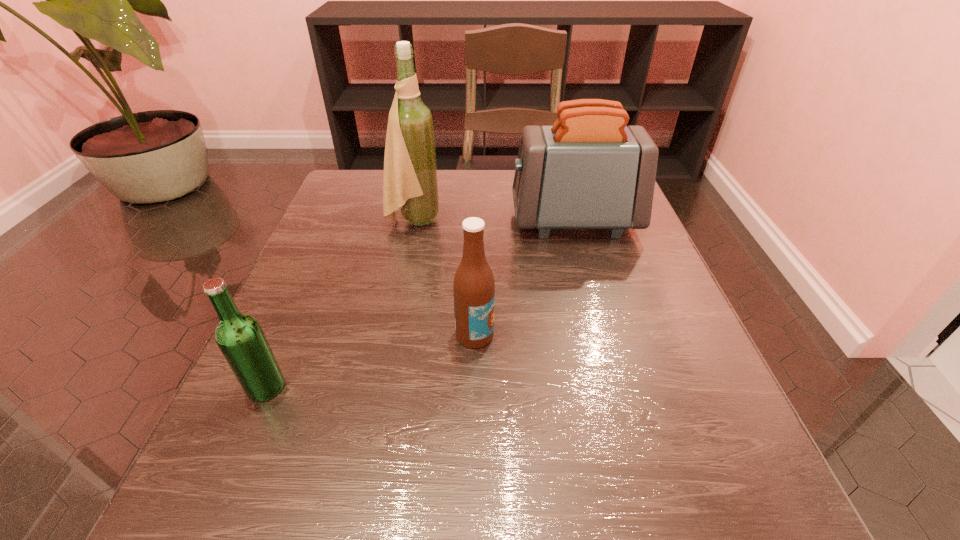
Identify the location of free space at the far edge. (513, 192).

In the image, there is a desktop. At what (x,y) coordinates should I click in order to perform the action: click on vacant space at the near edge. Please return your answer as a coordinate pair (x, y). The image size is (960, 540). Looking at the image, I should click on (620, 485).

Identify the location of vacant space at the right edge of the desktop. (617, 320).

Find the location of a particular element. The image size is (960, 540). vacant space at the far left corner of the desktop is located at coordinates (352, 213).

Locate an element on the screen. free spot between the rightmost object and the farther beer bottle is located at coordinates (524, 278).

The image size is (960, 540). Find the location of `free spot between the third farthest object and the third object from right to left`. free spot between the third farthest object and the third object from right to left is located at coordinates (444, 278).

Image resolution: width=960 pixels, height=540 pixels. Find the location of `vacant area that lies between the third object from right to left and the nearer beer bottle`. vacant area that lies between the third object from right to left and the nearer beer bottle is located at coordinates (340, 304).

You are a GUI agent. You are given a task and a screenshot of the screen. Output one action in this format:
    pyautogui.click(x=<x>, y=<y>)
    Task: Click on the free space between the right beer bottle and the left beer bottle
    Image resolution: width=960 pixels, height=540 pixels.
    Given the screenshot: What is the action you would take?
    pyautogui.click(x=371, y=361)

Locate an element on the screen. The height and width of the screenshot is (540, 960). free spot between the tallest object and the rightmost object is located at coordinates (494, 221).

I want to click on free spot between the toaster and the leftmost object, so click(x=420, y=304).